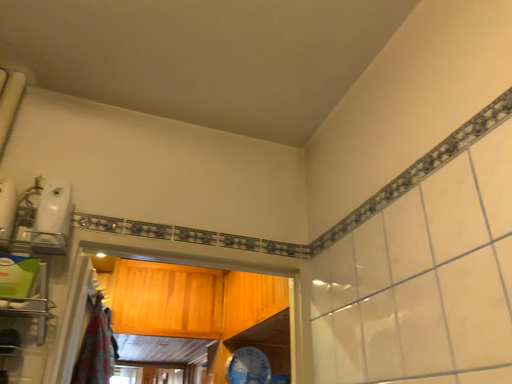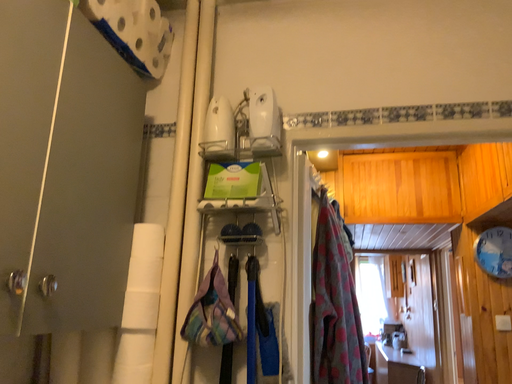
Question: Which way did the camera rotate in the video?

Choices:
 (A) rotated left
 (B) rotated right

Answer: (A)